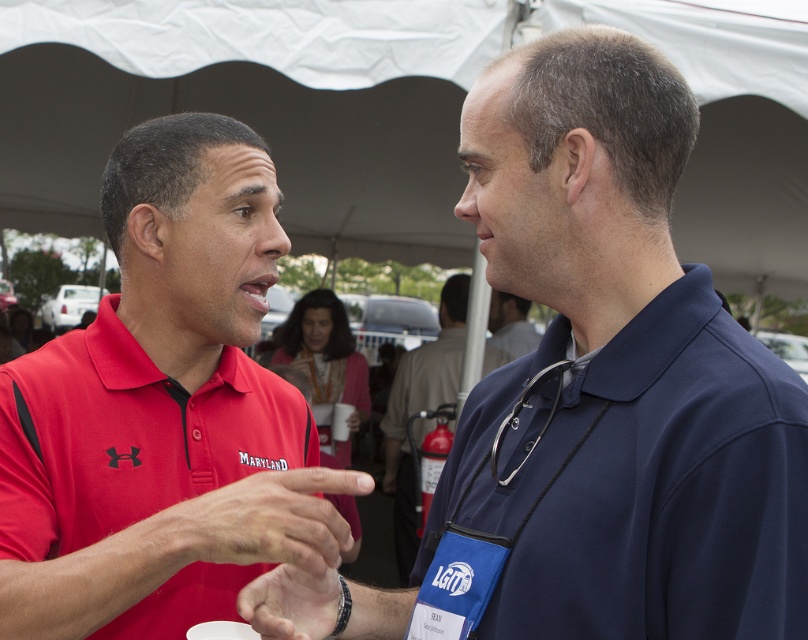
Question: Does smooth leather hand at center lie behind navy blue stethoscope at center?

Choices:
 (A) no
 (B) yes

Answer: (A)

Question: Does red matte polo shirt at center appear on the right side of navy blue stethoscope at center?

Choices:
 (A) yes
 (B) no

Answer: (B)

Question: Which object is farther from the camera taking this photo?

Choices:
 (A) navy blue shirt at center
 (B) blue fabric shirt at center
 (C) smooth leather watch at lower center
 (D) red matte polo shirt at center

Answer: (B)

Question: Which object is the closest to the red matte polo shirt at center?

Choices:
 (A) navy blue shirt at center
 (B) smooth leather watch at lower center

Answer: (B)

Question: Does smooth leather hand at center appear over navy blue stethoscope at center?

Choices:
 (A) no
 (B) yes

Answer: (B)

Question: Which object is the closest to the navy blue polo shirt at upper right?

Choices:
 (A) smooth leather hand at center
 (B) navy blue shirt at center
 (C) smooth leather watch at lower center

Answer: (B)